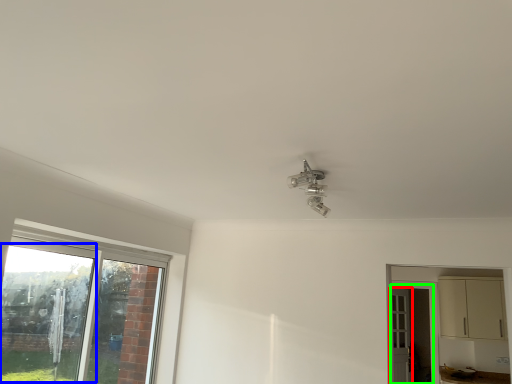
Question: Which object is positioned farthest from door (highlighted by a red box)? Select from window screen (highlighted by a blue box) and screen door (highlighted by a green box).

Choices:
 (A) window screen
 (B) screen door

Answer: (A)